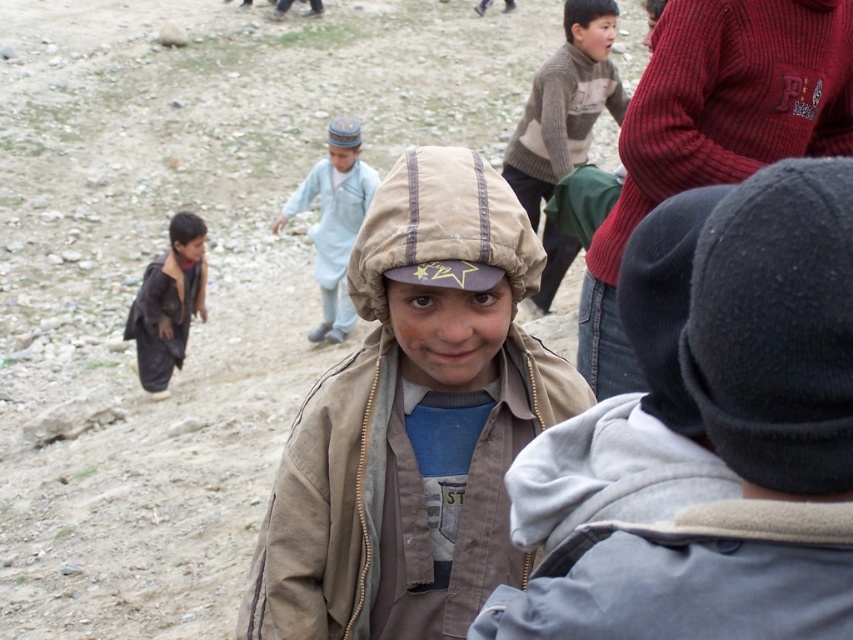
Does knitted wool sweater at upper center come behind light blue fabric dress at center?

No, it is not.

Measure the distance between point (567,80) and camera.

Point (567,80) is 7.59 meters from camera.

In order to click on knitted wool sweater at upper center in this screenshot , I will do `click(563, 113)`.

Does knitted sweater at upper center have a greater width compared to light blue fabric dress at center?

Incorrect, knitted sweater at upper center's width does not surpass light blue fabric dress at center's.

Which is behind, point (527, 125) or point (314, 168)?

Point (314, 168)

The height and width of the screenshot is (640, 853). I want to click on knitted sweater at upper center, so click(566, 104).

Measure the distance between brown fabric hat at center and camera.

They are 7.64 feet apart.

Is brown fabric hat at center below knitted wool sweater at upper center?

Yes, brown fabric hat at center is below knitted wool sweater at upper center.

Measure the distance between brown fabric hat at center and camera.

The distance of brown fabric hat at center from camera is 7.64 feet.

The height and width of the screenshot is (640, 853). I want to click on brown fabric hat at center, so click(x=413, y=420).